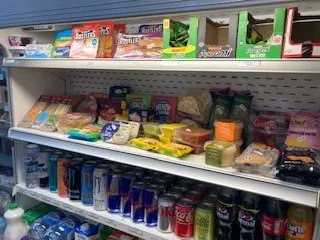
What are the coordinates of `bottle` in the screenshot? It's located at (10, 220), (86, 229).